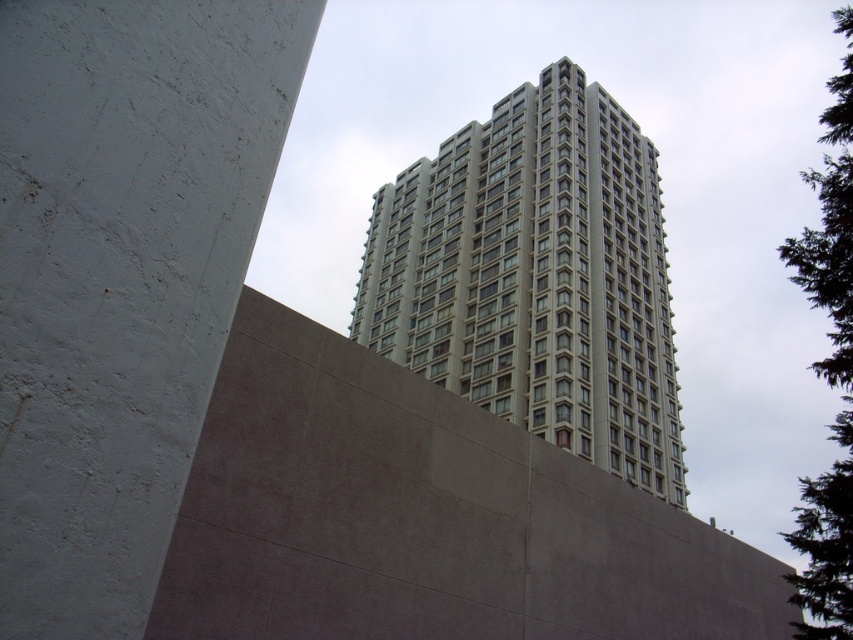
You are a drone operator who needs to fly a drone from the gray concrete building at upper center to the green textured tree at upper right. Given that the drone has a maximum flight range of 150 feet, will it be able to reach the destination without recharging?

The distance between the gray concrete building at upper center and the green textured tree at upper right is 142.29 feet, which is within the drone operator drone has a maximum flight range of 150 feet. Therefore, the drone can reach the destination without needing to recharge.

You are standing in front of the modern building and looking at two points marked on the image. The first point is at coordinates point (515, 332) and the second is at point (833, 374). Which point is closer to you?

Point (515, 332) is closer to you because it is further to the viewer than point (833, 374).